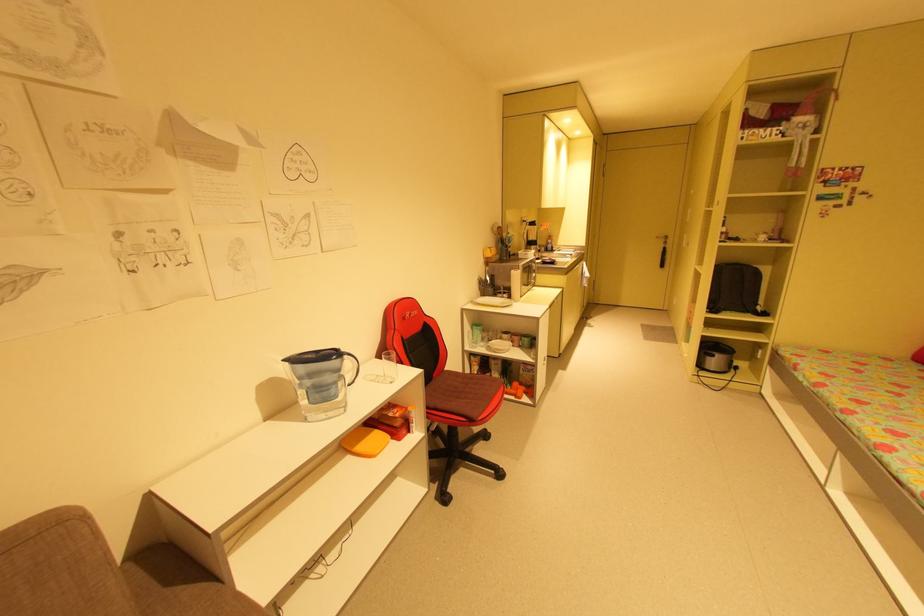
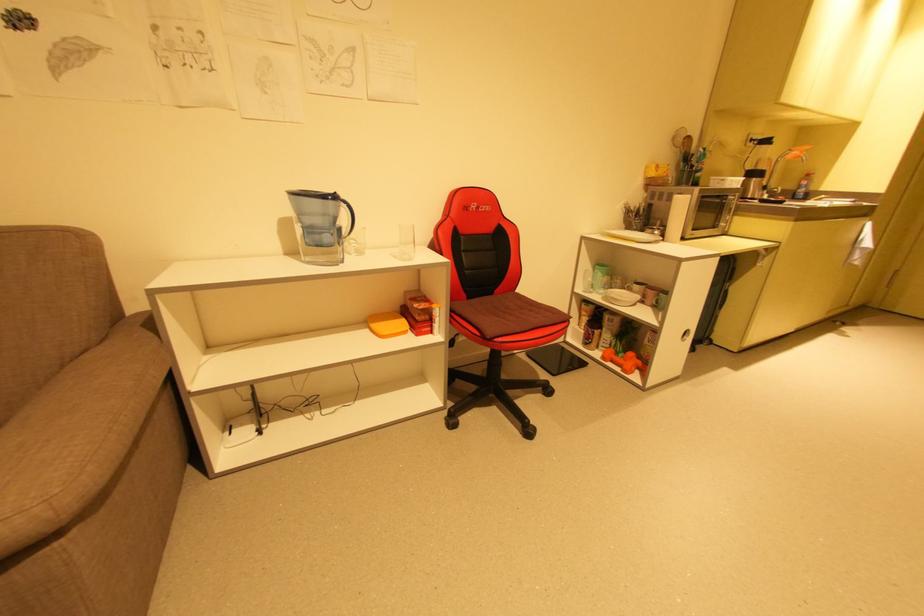
Locate, in the second image, the point that corresponds to pixel 348 357 in the first image.

(346, 204)